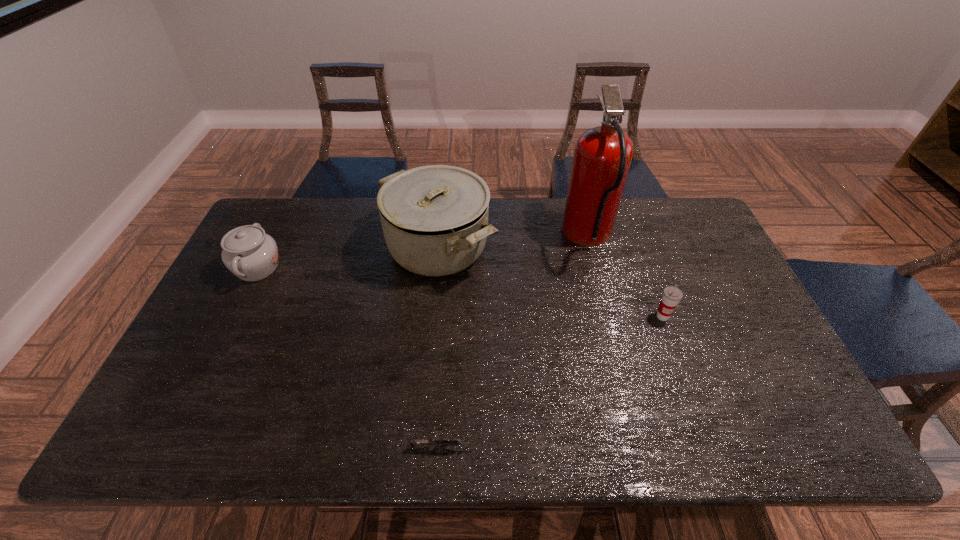
Locate an element on the screen. the second object from right to left is located at coordinates (602, 157).

Locate an element on the screen. the tallest object is located at coordinates (602, 157).

This screenshot has height=540, width=960. I want to click on the fourth shortest object, so click(x=434, y=218).

This screenshot has height=540, width=960. In order to click on chinaware in this screenshot , I will do `click(248, 252)`.

Find the location of a particular element. Image resolution: width=960 pixels, height=540 pixels. cup is located at coordinates (671, 296).

You are a GUI agent. You are given a task and a screenshot of the screen. Output one action in this format:
    pyautogui.click(x=<x>, y=<y>)
    Task: Click on the rightmost object
    The height and width of the screenshot is (540, 960).
    Given the screenshot: What is the action you would take?
    pyautogui.click(x=671, y=296)

Image resolution: width=960 pixels, height=540 pixels. In order to click on the shortest object in this screenshot , I will do `click(438, 442)`.

Locate an element on the screen. Image resolution: width=960 pixels, height=540 pixels. the nearest object is located at coordinates (438, 442).

This screenshot has height=540, width=960. Find the location of `vacant space located with the handle and nozzle on the tallest object`. vacant space located with the handle and nozzle on the tallest object is located at coordinates (527, 237).

The width and height of the screenshot is (960, 540). What are the coordinates of `vacant space situated 0.320m with the handle and nozzle on the tallest object` in the screenshot? It's located at (468, 237).